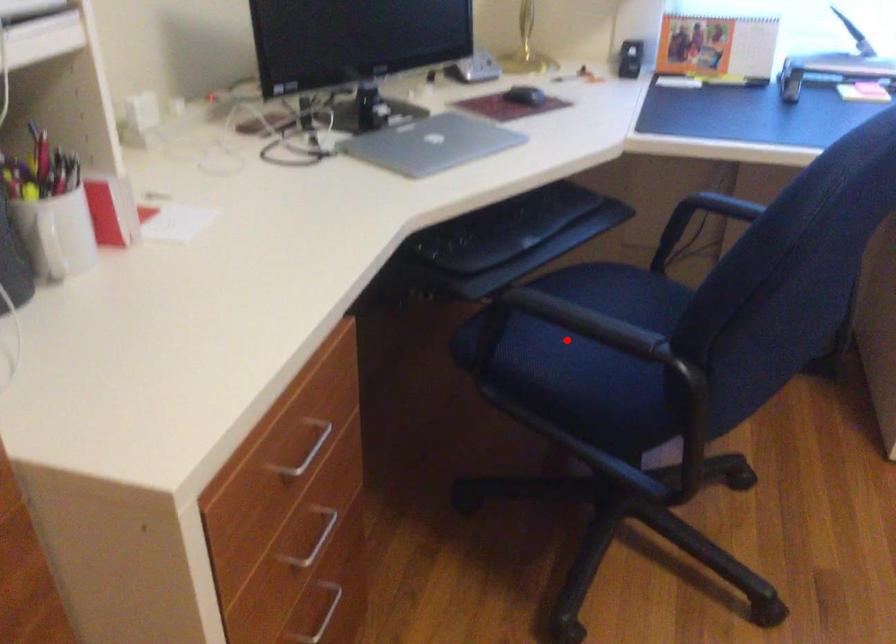
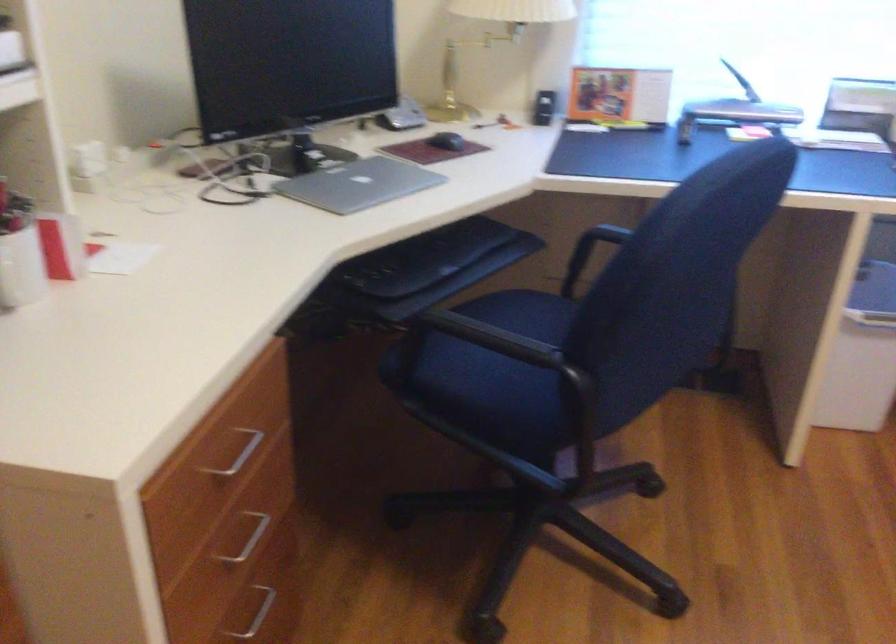
Question: I am providing you with two images of the same scene from different viewpoints. A red point is shown in image1. For the corresponding object point in image2, is it positioned nearer or farther from the camera?

Choices:
 (A) Nearer
 (B) Farther

Answer: (B)